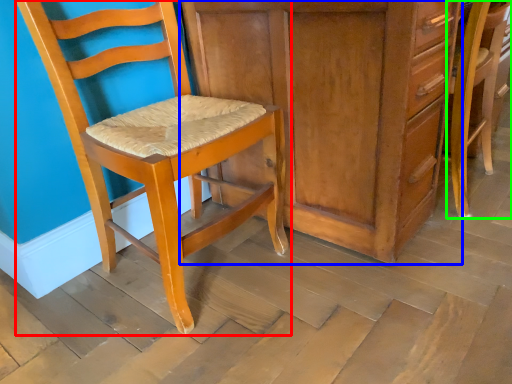
Question: Which is nearer to the chair (highlighted by a red box)? cabinetry (highlighted by a blue box) or chair (highlighted by a green box).

Choices:
 (A) cabinetry
 (B) chair

Answer: (A)